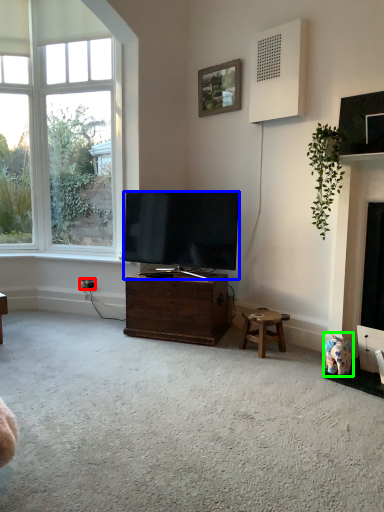
Question: Estimate the real-world distances between objects in this image. Which object is closer to power outlet (highlighted by a red box), television (highlighted by a blue box) or toy (highlighted by a green box)?

Choices:
 (A) television
 (B) toy

Answer: (A)